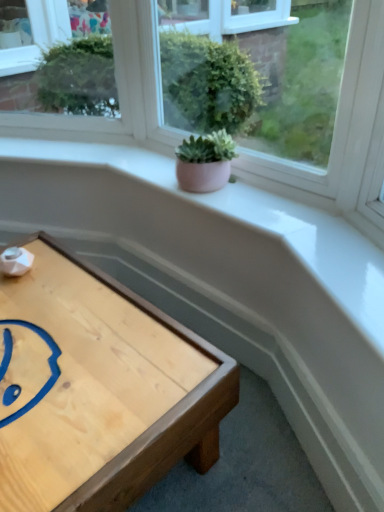
This screenshot has height=512, width=384. Describe the element at coordinates (98, 389) in the screenshot. I see `light wood/texture coffee table at lower left` at that location.

The image size is (384, 512). Find the location of `light wood/texture coffee table at lower left`. light wood/texture coffee table at lower left is located at coordinates (98, 389).

The width and height of the screenshot is (384, 512). What are the coordinates of `light wood/texture coffee table at lower left` in the screenshot? It's located at (98, 389).